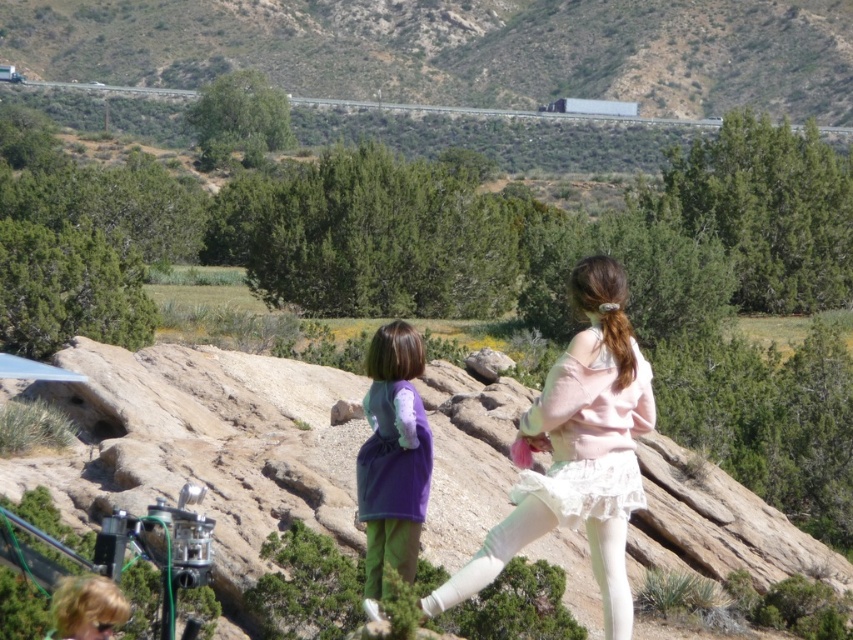
You are a photographer trying to capture both the pastel pink fabric skirt at center and the purple fleece dress at center in a single frame. Given their sizes, which one should you focus on to ensure both are clearly visible in the photo?

The pastel pink fabric skirt at center is smaller than the purple fleece dress at center. To ensure both are clearly visible, focus on the purple fleece dress at center as it is larger and will remain in focus while the smaller skirt will also be captured within the frame.

You are a photographer trying to capture the pastel pink fabric skirt at center in your shot. The camera is currently focused on the point at coordinates point (577, 452). Is the camera focused on the correct subject?

Yes, the camera is focused on the correct subject because the point (577, 452) corresponds to the pastel pink fabric skirt at center.

You are standing at the point closer to you between the two points, point (201, 1) and point (405, 525). Which point are you standing at?

You are standing at point (201, 1) because it is closer to you than point (405, 525).